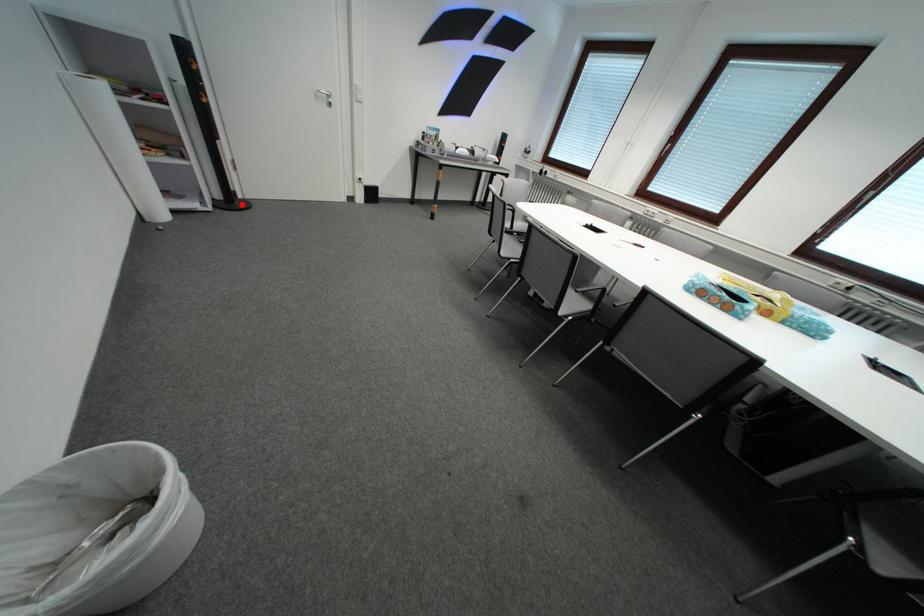
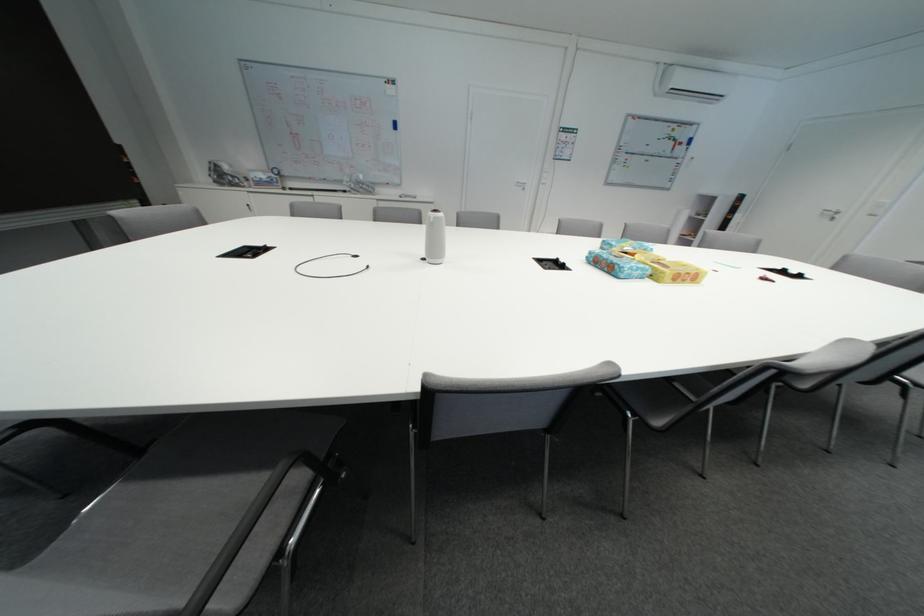
Question: I am providing you with two images of the same scene from different viewpoints. A red point is marked on the first image. At the location where the point appears in image 1, is it still visible in image 2?

Choices:
 (A) Yes
 (B) No

Answer: (B)